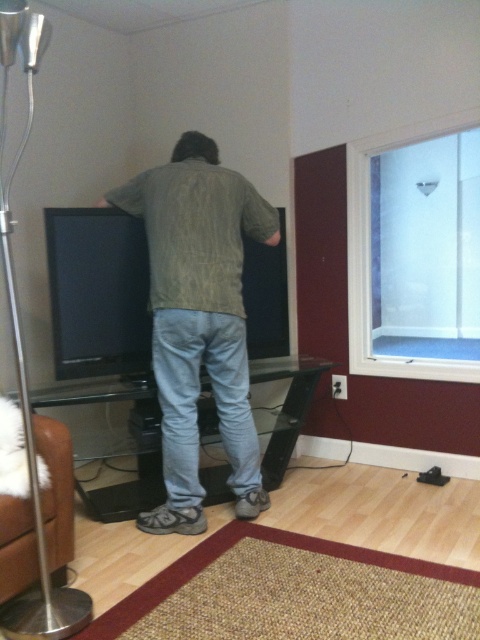
You are an interior designer assessing the room layout. You notice the green textured shirt at center and the clear glass window at upper right. Which object occupies a greater area in the image?

The green textured shirt at center is larger in size than the clear glass window at upper right, so it occupies a greater area in the image.

You are a home inspector assessing the room layout. You notice the green textured shirt at center and the clear glass window at upper right. Which object is positioned higher in the room?

The green textured shirt at center is taller than the clear glass window at upper right, so the green textured shirt at center is positioned higher in the room.

You are a delivery person who needs to place a large package in this room. The package is 1.2 meters wide. You see the green textured shirt at center and the clear glass window at upper right. Can you fit the package between them?

The distance between the green textured shirt at center and the clear glass window at upper right is 1.00 meters. Since the package is 1.2 meters wide, it cannot fit between them as the space is narrower than the package.